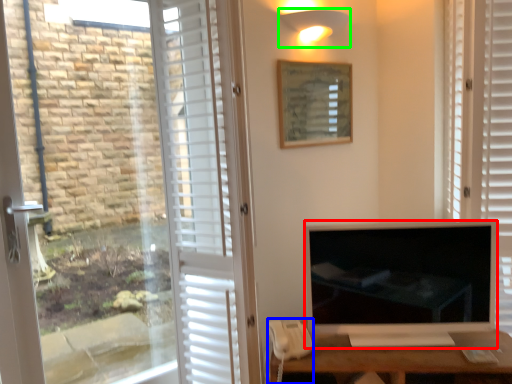
Question: Based on their relative distances, which object is farther from television (highlighted by a red box)? Choose from corded phone (highlighted by a blue box) and light fixture (highlighted by a green box).

Choices:
 (A) corded phone
 (B) light fixture

Answer: (B)